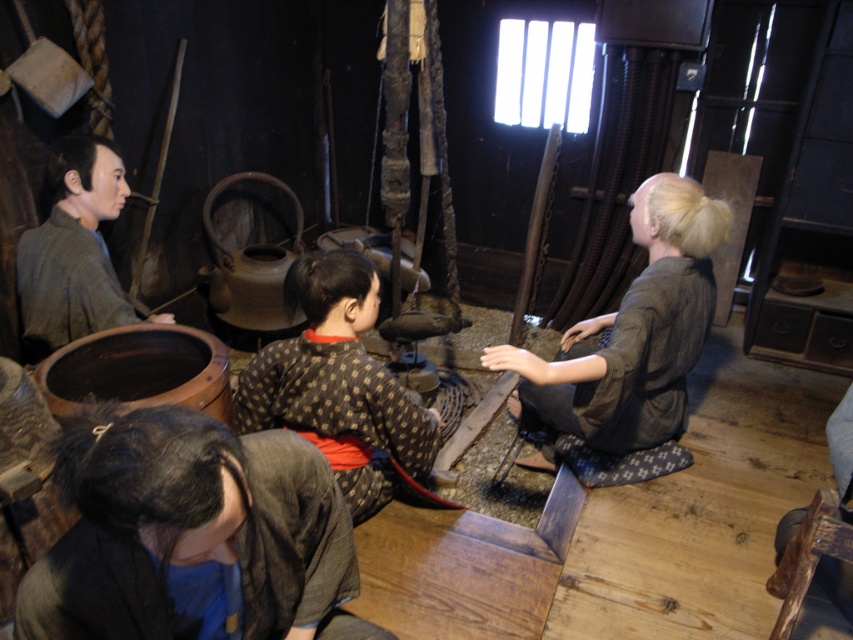
You are a visitor in this traditional Japanese room and want to pick up both the dark gray kimono at lower left and the brown textured kimono at center. If you start from the entrance, which kimono should you reach first?

The dark gray kimono at lower left is closer to the entrance than the brown textured kimono at center, so you should reach the dark gray kimono at lower left first.

You are standing in the center of the room and want to reach the point closer to you. Which point should you move towards, point (332, 529) or point (595, 374)?

Point (332, 529) is in front of point (595, 374), so you should move towards point (332, 529) to reach the closer one.

You are a tailor working in this traditional Japanese room. You need to hang both the brown textured kimono at center and the matte gray kimono at left on a rack that can only hold items up to the height of the taller one. Which kimono should you use to determine the rack height requirement?

The brown textured kimono at center is much taller than the matte gray kimono at left, so you should use the height of the brown textured kimono at center to determine the rack height requirement.